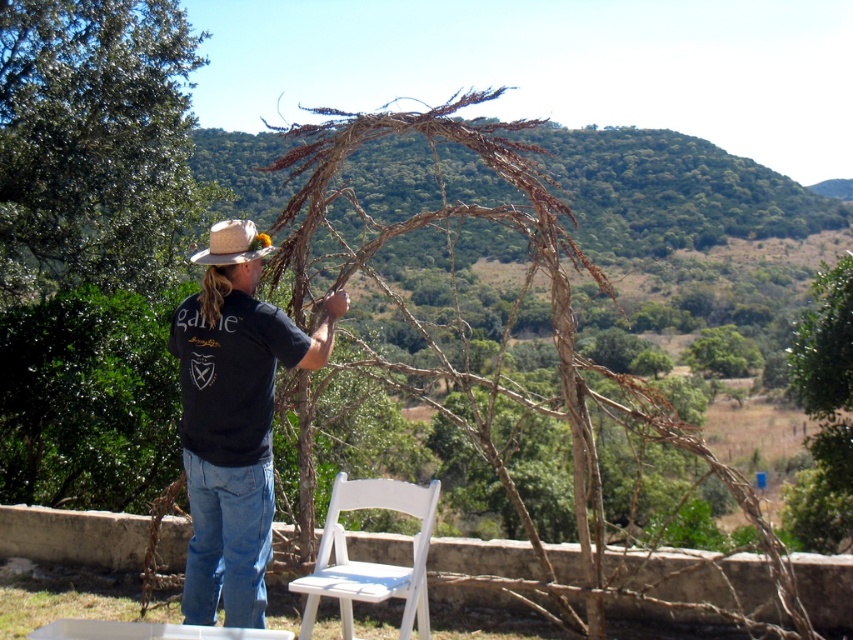
Question: Among these objects, which one is nearest to the camera?

Choices:
 (A) dry wood branch at center
 (B) natural straw cowboy hat at left
 (C) white wood chair at lower center
 (D) black cotton shirt at center

Answer: (C)

Question: Is white wood chair at lower center further to camera compared to natural straw cowboy hat at left?

Choices:
 (A) yes
 (B) no

Answer: (B)

Question: Which object is positioned closest to the white wood chair at lower center?

Choices:
 (A) natural straw cowboy hat at left
 (B) black cotton shirt at center
 (C) dry wood branch at center

Answer: (B)

Question: Can you confirm if dry wood branch at center is positioned below natural straw cowboy hat at left?

Choices:
 (A) yes
 (B) no

Answer: (B)

Question: Can you confirm if black cotton shirt at center is positioned to the left of white wood chair at lower center?

Choices:
 (A) no
 (B) yes

Answer: (B)

Question: Estimate the real-world distances between objects in this image. Which object is closer to the white wood chair at lower center?

Choices:
 (A) dry wood branch at center
 (B) natural straw cowboy hat at left

Answer: (B)